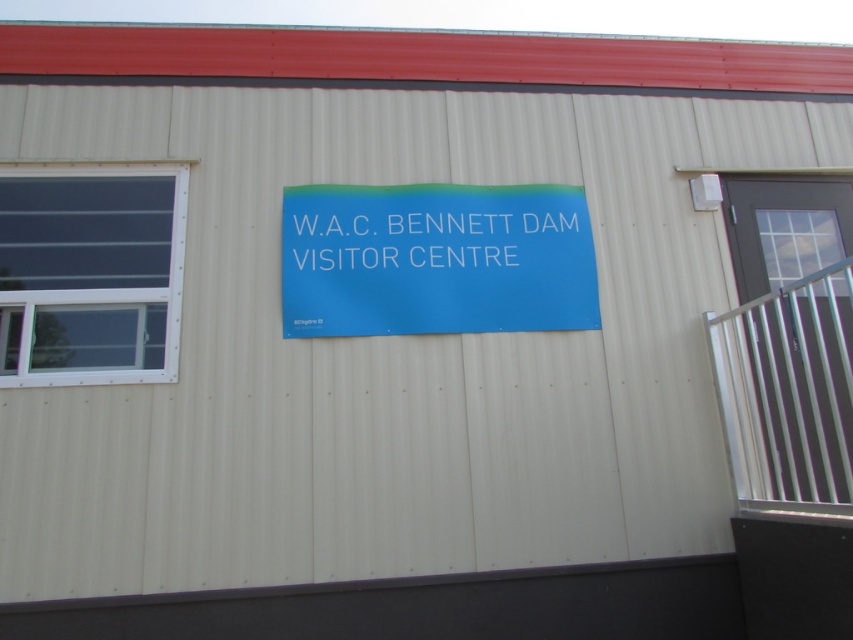
Who is lower down, clear glass window at left or white plastic sign at center?

Positioned lower is clear glass window at left.

Between clear glass window at left and white plastic sign at center, which one appears on the left side from the viewer's perspective?

clear glass window at left

Which is behind, point (39, 275) or point (553, 252)?

Point (553, 252)

Locate an element on the screen. This screenshot has height=640, width=853. clear glass window at left is located at coordinates (90, 273).

Can you confirm if blue matte sign at center is smaller than clear glass window at left?

Actually, blue matte sign at center might be larger than clear glass window at left.

Between point (351, 259) and point (160, 195), which one is positioned in front?

Point (351, 259) is more forward.

Find the location of `blue matte sign at center`. blue matte sign at center is located at coordinates (434, 259).

From the picture: Who is higher up, blue matte sign at center or white plastic sign at center?

Positioned higher is white plastic sign at center.

Can you confirm if blue matte sign at center is bigger than white plastic sign at center?

Indeed, blue matte sign at center has a larger size compared to white plastic sign at center.

Find the location of a particular element. blue matte sign at center is located at coordinates (434, 259).

Image resolution: width=853 pixels, height=640 pixels. What are the coordinates of `blue matte sign at center` in the screenshot? It's located at (434, 259).